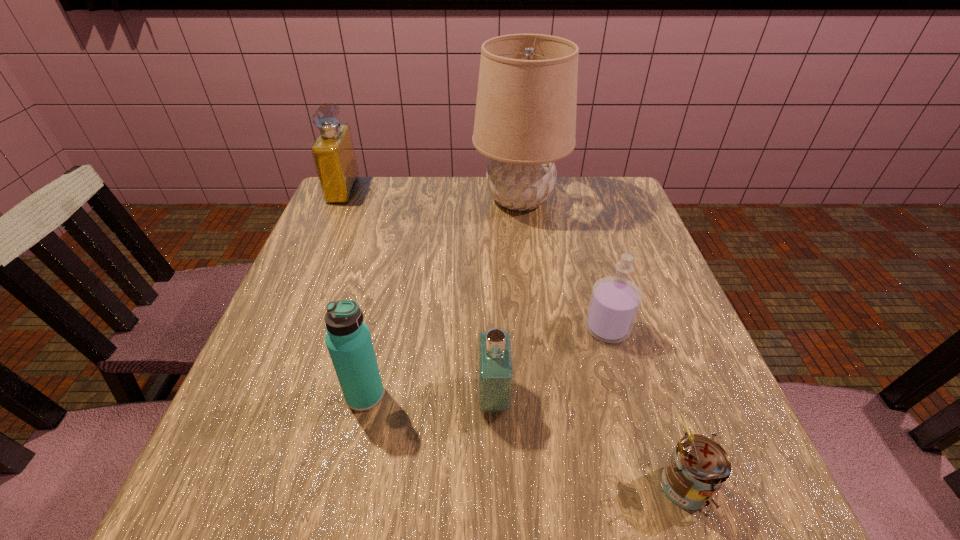
You are a GUI agent. You are given a task and a screenshot of the screen. Output one action in this format:
    pyautogui.click(x=<x>, y=<y>)
    Task: Click on the vacant space at the far right corner of the desktop
    
    Given the screenshot: What is the action you would take?
    pyautogui.click(x=630, y=208)

You are a GUI agent. You are given a task and a screenshot of the screen. Output one action in this format:
    pyautogui.click(x=<x>, y=<y>)
    Task: Click on the vacant area between the lampshade and the leftmost perfume
    The height and width of the screenshot is (540, 960).
    Given the screenshot: What is the action you would take?
    pyautogui.click(x=431, y=195)

The height and width of the screenshot is (540, 960). I want to click on vacant area that lies between the fifth object from right to left and the nearest perfume, so click(429, 396).

Where is `vacant area that lies between the fifth object from right to left and the second perfume from right to left`? This screenshot has width=960, height=540. vacant area that lies between the fifth object from right to left and the second perfume from right to left is located at coordinates (429, 396).

What are the coordinates of `free space between the rightmost perfume and the tallest object` in the screenshot? It's located at (564, 264).

At what (x,y) coordinates should I click in order to perform the action: click on unoccupied position between the lampshade and the farthest perfume. Please return your answer as a coordinate pair (x, y). This screenshot has width=960, height=540. Looking at the image, I should click on (431, 195).

Where is `vacant area that lies between the tallest object and the second perfume from left to right`? This screenshot has height=540, width=960. vacant area that lies between the tallest object and the second perfume from left to right is located at coordinates (507, 298).

Image resolution: width=960 pixels, height=540 pixels. Identify the location of free space that is in between the second perfume from left to right and the nearest object. (587, 441).

Where is `unoccupied area between the tallest object and the nearest perfume`? The width and height of the screenshot is (960, 540). unoccupied area between the tallest object and the nearest perfume is located at coordinates (507, 298).

What are the coordinates of `object that ranks as the second closest to the second perfume from right to left` in the screenshot? It's located at (615, 301).